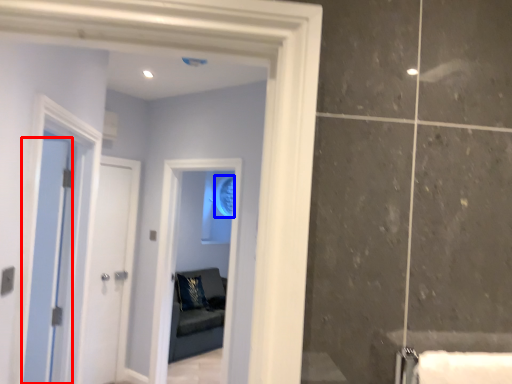
Question: Which object is closer to the camera taking this photo, door (highlighted by a red box) or mirror (highlighted by a blue box)?

Choices:
 (A) door
 (B) mirror

Answer: (A)